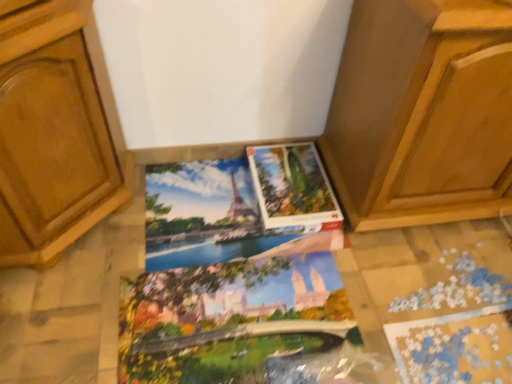
Identify the location of free spot behind matte paper coloring book at center, positioned as the 2th coloring book in top-to-bottom order. (201, 211).